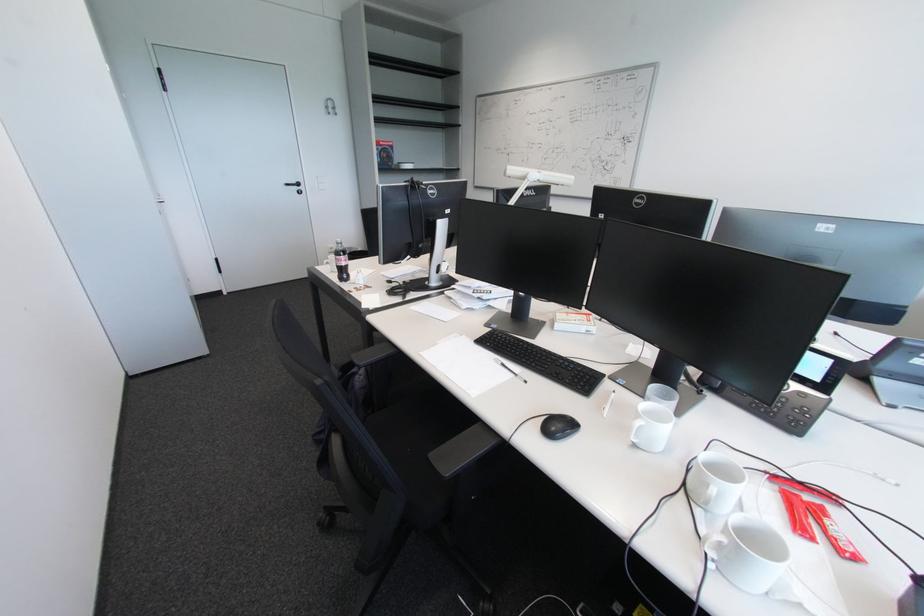
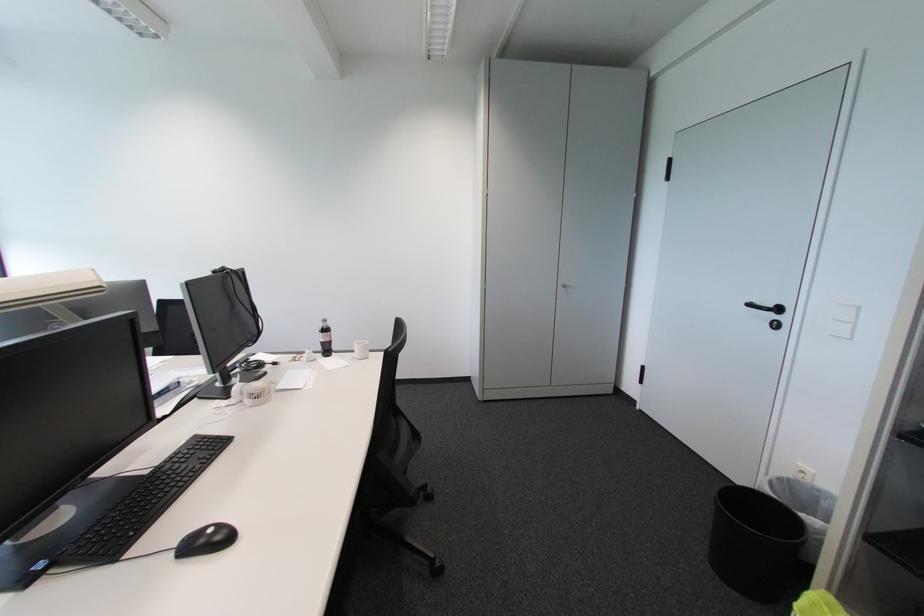
Find the pixel in the second image that matches pixel 304 190 in the first image.

(777, 317)